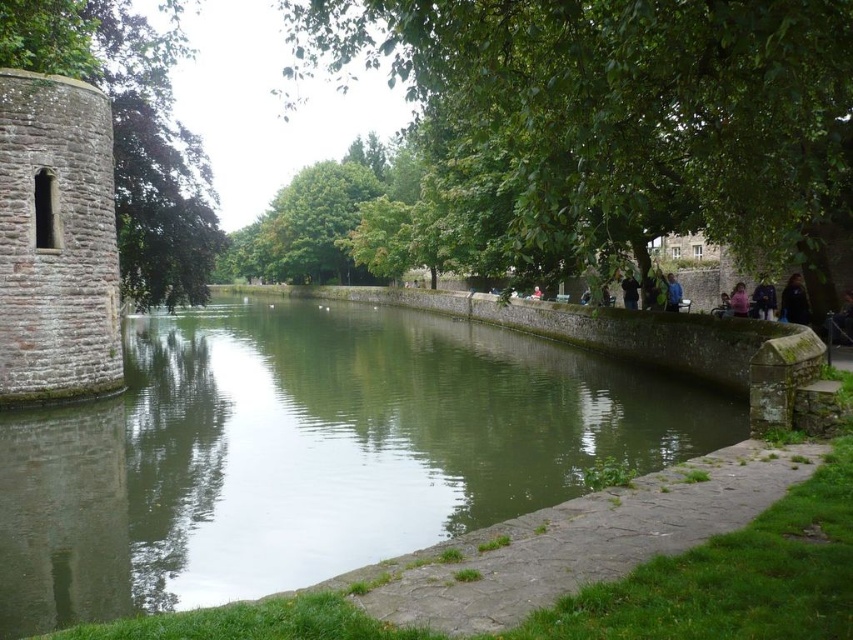
Question: Does green leafy tree at left appear on the left side of blue denim jacket at right?

Choices:
 (A) yes
 (B) no

Answer: (A)

Question: In this image, where is green leafy tree at center located relative to black leather jacket at upper right?

Choices:
 (A) right
 (B) left

Answer: (B)

Question: Which object is positioned farthest from the dark blue fabric at center-right?

Choices:
 (A) brick stone tower at left
 (B) dark blue fabric at right

Answer: (A)

Question: Is green stone river at center above blue denim jacket at right?

Choices:
 (A) yes
 (B) no

Answer: (B)

Question: Which of the following is the closest to the observer?

Choices:
 (A) (625, 288)
 (B) (132, 180)
 (C) (51, 339)

Answer: (C)

Question: Which is nearer to the green stone river at center?

Choices:
 (A) dark brown hair at right
 (B) green leafy tree at left

Answer: (B)